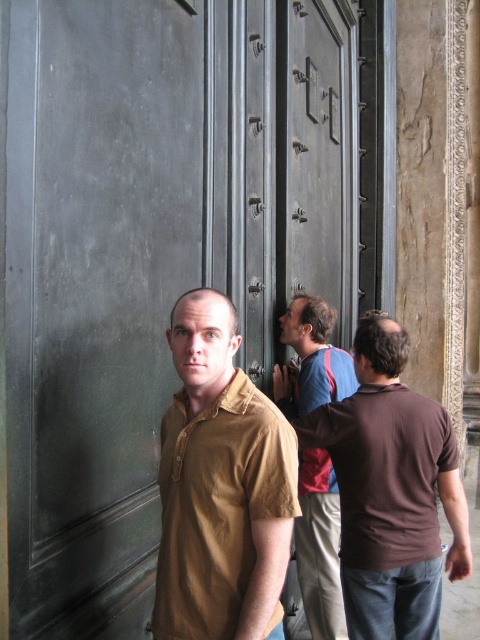
You are a photographer trying to capture a group photo of the two people in front of the ornate door. Since the brown cotton shirt at right is larger than the blue striped shirt at center, which person should you position closer to the camera to make them appear the same size in the photo?

To make the brown cotton shirt at right and the blue striped shirt at center appear the same size in the photo, position the smaller blue striped shirt at center closer to the camera since it is smaller than the brown cotton shirt at right.

You are a photographer trying to capture a group photo of the brown cotton shirt at center and the blue striped shirt at center. Since you want to ensure both subjects are in focus, you need to know which one is taller. Can you determine which of the two is taller?

The brown cotton shirt at center is taller than the blue striped shirt at center, so you should adjust the camera angle to account for their height difference to ensure both are in focus.

You are a tour guide leading a group in front of a historical metal door. You notice two people wearing brown cotton shirts. One is at the center and the other at the right. From the perspective of the person in the brown cotton shirt at center, where is the other person wearing a brown cotton shirt at right located?

The brown cotton shirt at right is to the right of the brown cotton shirt at center.